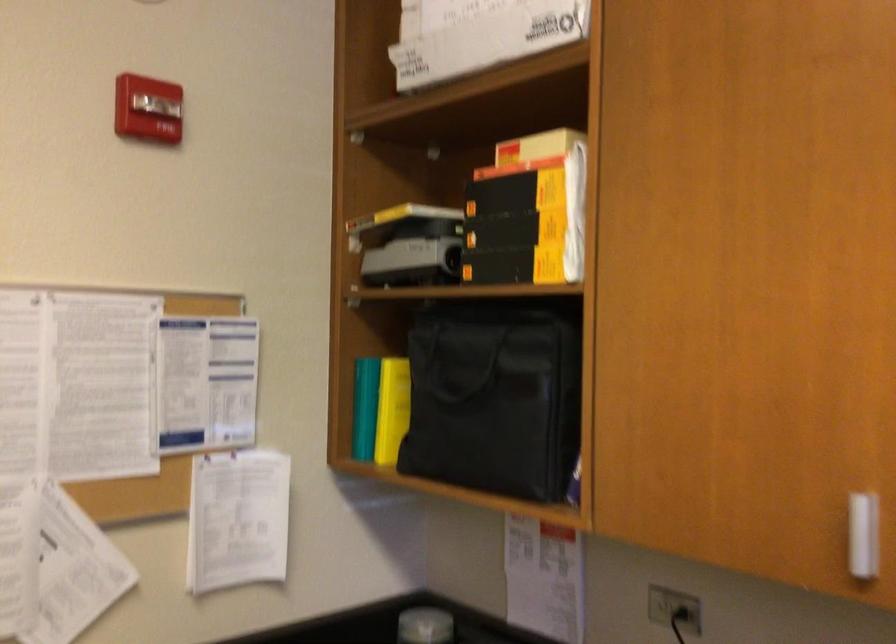
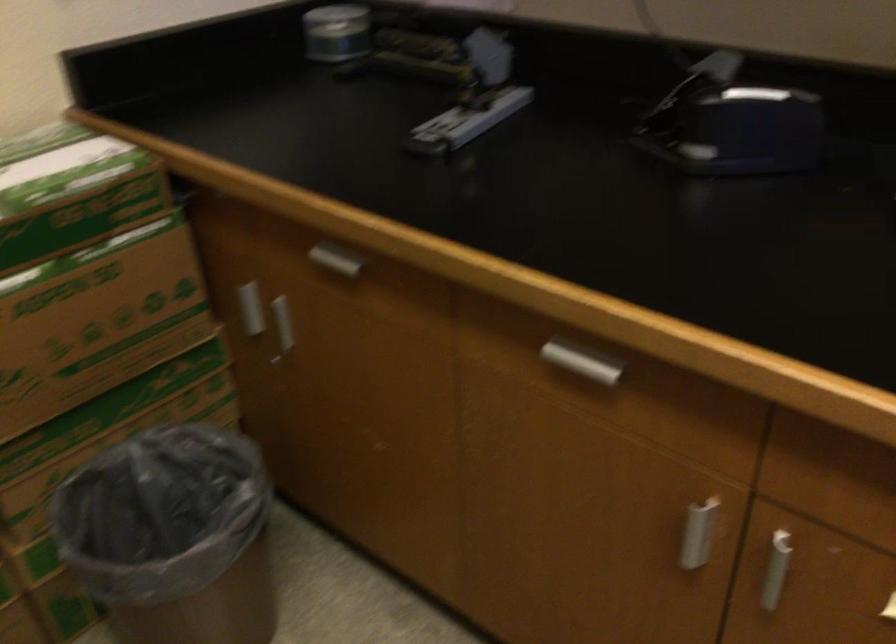
Question: The images are taken continuously from a first-person perspective. In which direction is your viewpoint rotating?

Choices:
 (A) Left
 (B) Right
 (C) Up
 (D) Down

Answer: (D)